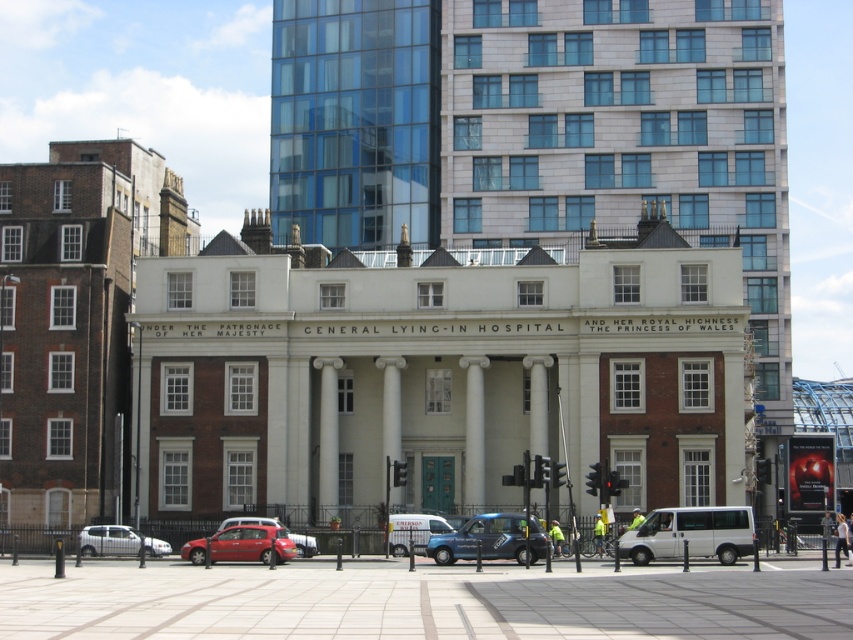
Question: Where is white stone building at center located in relation to metallic red car at center in the image?

Choices:
 (A) above
 (B) below

Answer: (A)

Question: Which of the following is the closest to the observer?

Choices:
 (A) pos(440,557)
 (B) pos(189,541)
 (C) pos(303,547)
 (D) pos(680,524)

Answer: (D)

Question: Does white stone building at center appear on the left side of silver metallic hatchback at lower left?

Choices:
 (A) yes
 (B) no

Answer: (B)

Question: Which point is farther from the camera taking this photo?

Choices:
 (A) (659, 541)
 (B) (532, 540)
 (C) (84, 548)
 (D) (300, 548)

Answer: (C)

Question: Which object appears closest to the camera in this image?

Choices:
 (A) shiny red car at center
 (B) blue metallic taxi at center
 (C) white stone building at center

Answer: (B)

Question: Is white stone building at center smaller than white matte van at center?

Choices:
 (A) yes
 (B) no

Answer: (B)